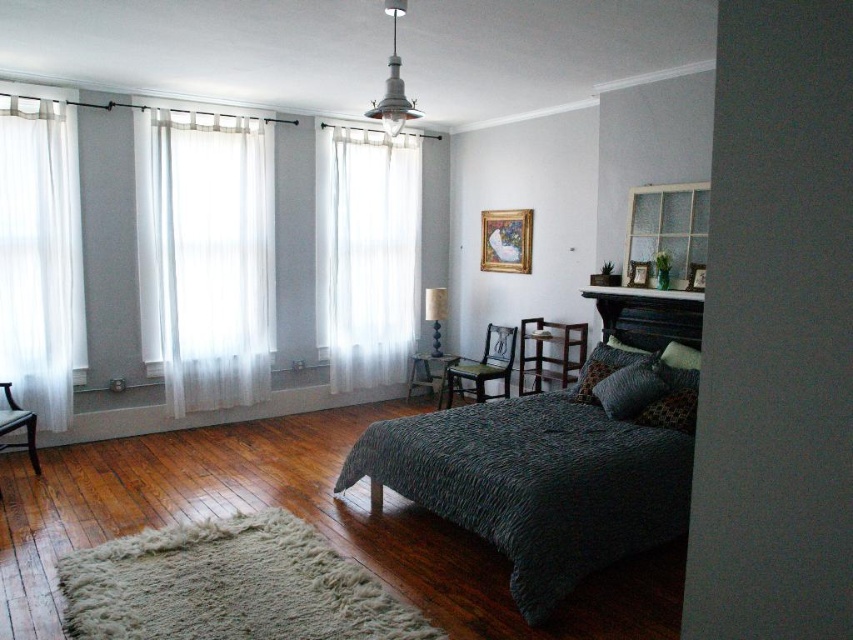
Question: Observing the image, what is the correct spatial positioning of white sheer curtain at center in reference to velvet green pillow at center?

Choices:
 (A) above
 (B) below

Answer: (A)

Question: Considering the relative positions of dark textured bed at center and sheer white curtain at left in the image provided, where is dark textured bed at center located with respect to sheer white curtain at left?

Choices:
 (A) right
 (B) left

Answer: (A)

Question: Is dark gray textured pillow at center closer to camera compared to wooden stool at center?

Choices:
 (A) no
 (B) yes

Answer: (B)

Question: Estimate the real-world distances between objects in this image. Which object is farther from the white sheer curtain at left?

Choices:
 (A) white sheer curtain at center
 (B) dark textured bed at center
 (C) sheer white curtain at left

Answer: (B)

Question: Which object appears closest to the camera in this image?

Choices:
 (A) sheer white curtain at left
 (B) dark gray textured pillow at center
 (C) white sheer curtain at left

Answer: (B)

Question: Which point is closer to the camera?

Choices:
 (A) (421, 372)
 (B) (26, 340)
 (C) (415, 152)
 (D) (489, 346)

Answer: (B)